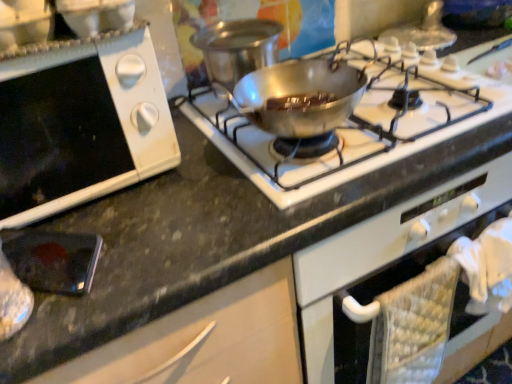
Question: From the image's perspective, does metallic silver pan at center appear higher than white matte oven at lower left?

Choices:
 (A) yes
 (B) no

Answer: (A)

Question: Can you confirm if metallic silver pan at center is taller than white matte oven at lower left?

Choices:
 (A) yes
 (B) no

Answer: (B)

Question: Considering the relative sizes of metallic silver pan at center and white matte oven at lower left in the image provided, is metallic silver pan at center wider than white matte oven at lower left?

Choices:
 (A) no
 (B) yes

Answer: (A)

Question: Does metallic silver pan at center appear on the left side of white matte oven at lower left?

Choices:
 (A) no
 (B) yes

Answer: (A)

Question: Considering the relative sizes of metallic silver pan at center and white matte oven at lower left in the image provided, is metallic silver pan at center thinner than white matte oven at lower left?

Choices:
 (A) no
 (B) yes

Answer: (B)

Question: Do you think shiny silver pan at center is within metallic silver phone at lower left, or outside of it?

Choices:
 (A) inside
 (B) outside

Answer: (B)

Question: In the image, is shiny silver pan at center positioned in front of or behind metallic silver phone at lower left?

Choices:
 (A) behind
 (B) front

Answer: (A)

Question: From the image's perspective, relative to metallic silver phone at lower left, is shiny silver pan at center above or below?

Choices:
 (A) below
 (B) above

Answer: (B)

Question: In the image, is shiny silver pan at center on the left side or the right side of metallic silver phone at lower left?

Choices:
 (A) right
 (B) left

Answer: (A)

Question: Is metallic silver phone at lower left wider or thinner than shiny silver pan at center?

Choices:
 (A) thin
 (B) wide

Answer: (A)

Question: Relative to shiny silver pan at center, is metallic silver phone at lower left in front or behind?

Choices:
 (A) behind
 (B) front

Answer: (B)

Question: Do you think metallic silver phone at lower left is within shiny silver pan at center, or outside of it?

Choices:
 (A) inside
 (B) outside

Answer: (B)

Question: From a real-world perspective, is metallic silver phone at lower left above or below shiny silver pan at center?

Choices:
 (A) above
 (B) below

Answer: (B)

Question: Looking at their shapes, would you say metallic silver pan at center is wider or thinner than white matte oven at lower left?

Choices:
 (A) wide
 (B) thin

Answer: (B)

Question: From a real-world perspective, is metallic silver pan at center positioned above or below white matte oven at lower left?

Choices:
 (A) above
 (B) below

Answer: (B)